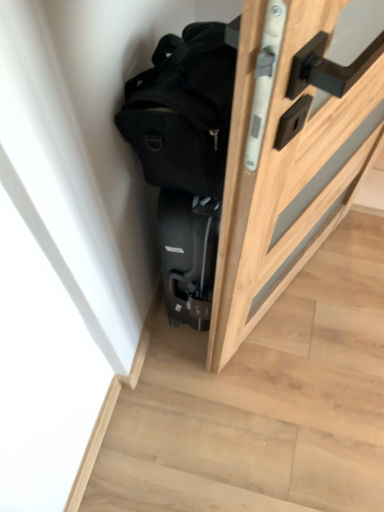
You are a GUI agent. You are given a task and a screenshot of the screen. Output one action in this format:
    pyautogui.click(x=<x>, y=<y>)
    Task: Click on the vacant location below wooden door at right (from a real-world perspective)
    The image size is (384, 512).
    Given the screenshot: What is the action you would take?
    pyautogui.click(x=279, y=308)